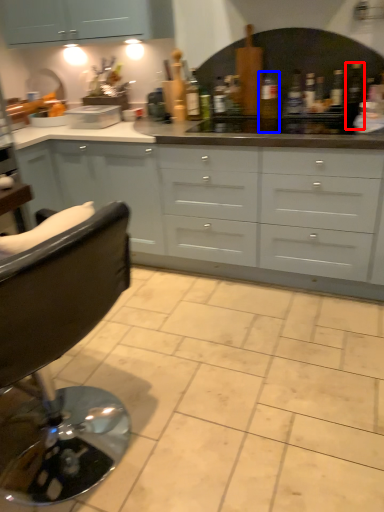
Question: Which point is closer to the camera, bottle (highlighted by a red box) or bottle (highlighted by a blue box)?

Choices:
 (A) bottle
 (B) bottle

Answer: (A)